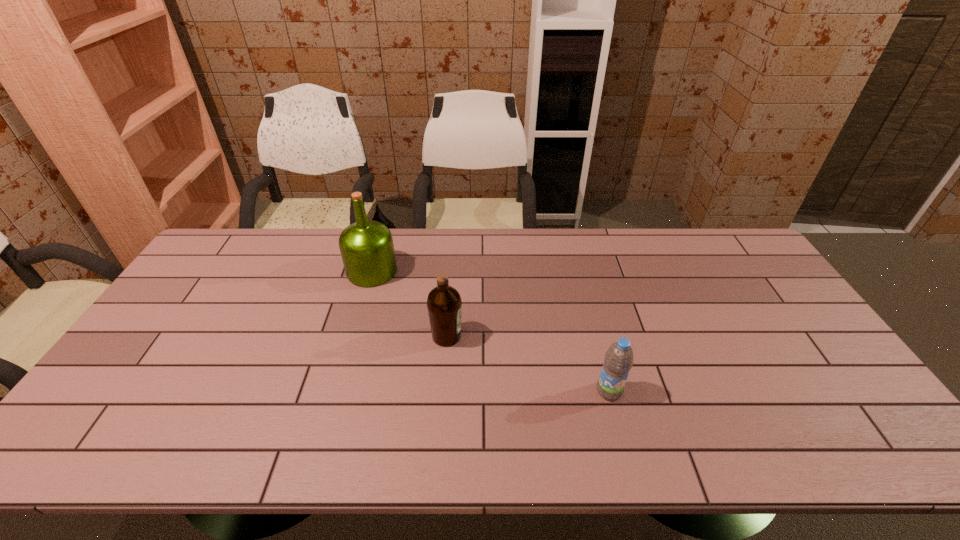
Identify the location of free space between the rightmost object and the second object from right to left. This screenshot has width=960, height=540. (528, 363).

You are a GUI agent. You are given a task and a screenshot of the screen. Output one action in this format:
    pyautogui.click(x=<x>, y=<y>)
    Task: Click on the free spot between the leftmost object and the water bottle
    The width and height of the screenshot is (960, 540).
    Given the screenshot: What is the action you would take?
    pyautogui.click(x=491, y=331)

In order to click on free spot between the water bottle and the tallest object in this screenshot , I will do `click(491, 331)`.

I want to click on vacant region between the nearest object and the shorter olive oil, so click(x=528, y=363).

Identify which object is the second nearest to the rightmost object. Please provide its 2D coordinates. Your answer should be formatted as a tuple, i.e. [(x, y)], where the tuple contains the x and y coordinates of a point satisfying the conditions above.

[(367, 250)]

This screenshot has width=960, height=540. I want to click on object that ranks as the closest to the right olive oil, so (x=367, y=250).

Where is `vacant area that satisfies the following two spatial constraints: 1. on the front side of the rightmost object; 2. on the left side of the leftmost object`? vacant area that satisfies the following two spatial constraints: 1. on the front side of the rightmost object; 2. on the left side of the leftmost object is located at coordinates (338, 391).

The image size is (960, 540). What are the coordinates of `vacant space that satisfies the following two spatial constraints: 1. on the label of the second farthest object; 2. on the right side of the water bottle` in the screenshot? It's located at (443, 391).

At what (x,y) coordinates should I click in order to perform the action: click on free spot that satisfies the following two spatial constraints: 1. on the front side of the left olive oil; 2. on the right side of the shortest object. Please return your answer as a coordinate pair (x, y). Looking at the image, I should click on (338, 391).

Identify the location of free space that satisfies the following two spatial constraints: 1. on the label of the shorter olive oil; 2. on the right side of the rightmost object. This screenshot has height=540, width=960. (443, 391).